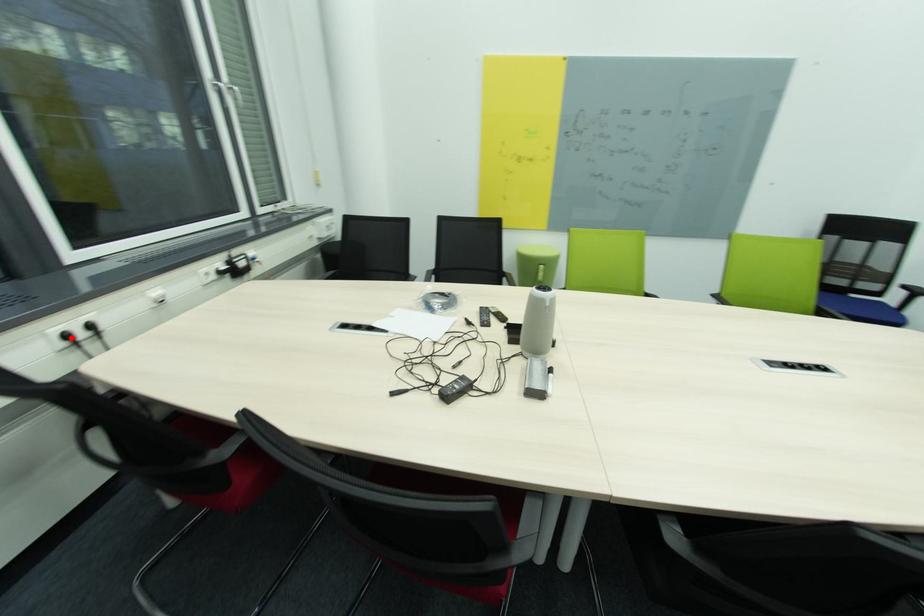
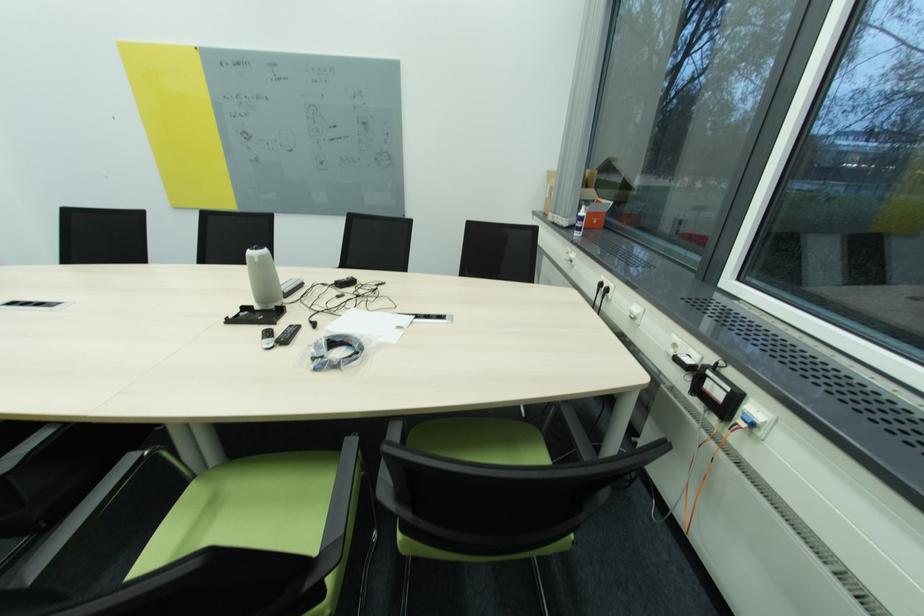
Question: I am providing you with two images of the same scene from different viewpoints. In image1, a red point is highlighted. Considering the same 3D point in image2, which of the following is correct?

Choices:
 (A) It is closer
 (B) It is farther

Answer: (A)